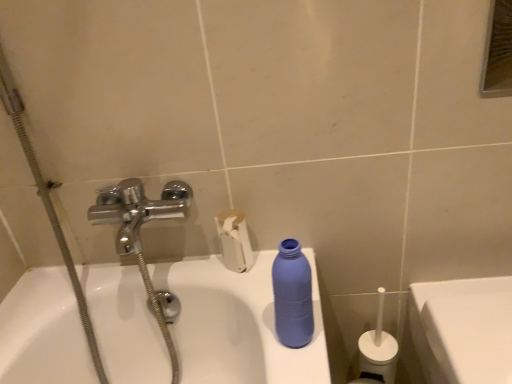
Question: Does point (281, 337) appear closer or farther from the camera than point (229, 249)?

Choices:
 (A) farther
 (B) closer

Answer: (B)

Question: In terms of width, does matte blue plastic bottle at center look wider or thinner when compared to white matte toilet paper at upper center?

Choices:
 (A) wide
 (B) thin

Answer: (B)

Question: Based on their relative distances, which object is nearer to the matte blue plastic bottle at center?

Choices:
 (A) metallic rectangular mirror at upper right
 (B) white glossy porcelain at lower right
 (C) white matte toilet paper at upper center

Answer: (C)

Question: Which object is the farthest from the white matte toilet paper at upper center?

Choices:
 (A) matte blue plastic bottle at center
 (B) white glossy porcelain at lower right
 (C) metallic rectangular mirror at upper right

Answer: (C)